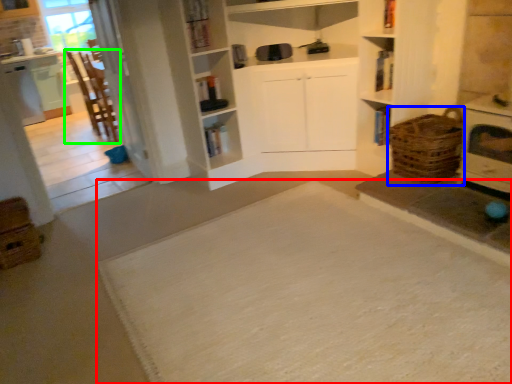
Question: Which object is the farthest from doormat (highlighted by a red box)? Choose among these: basket (highlighted by a blue box) or chair (highlighted by a green box).

Choices:
 (A) basket
 (B) chair

Answer: (B)